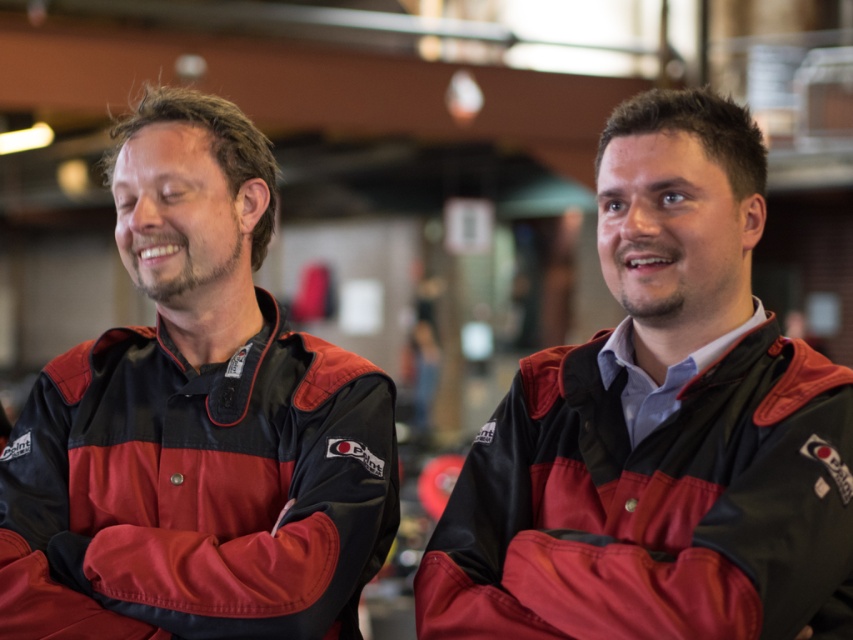
Who is shorter, matte black jacket at center or matte nylon jacket at center?

matte nylon jacket at center is shorter.

Does point (433, 582) come closer to viewer compared to point (204, 515)?

Yes, point (433, 582) is in front of point (204, 515).

This screenshot has width=853, height=640. I want to click on matte black jacket at center, so click(x=659, y=428).

Which is above, matte black jacket at center or matte black jacket at left?

Positioned higher is matte black jacket at left.

The width and height of the screenshot is (853, 640). Identify the location of matte black jacket at center. (659, 428).

Is matte black jacket at left below matte nylon jacket at center?

No.

Who is shorter, matte black jacket at left or matte nylon jacket at center?

With less height is matte nylon jacket at center.

Where is `matte black jacket at left`? matte black jacket at left is located at coordinates (196, 422).